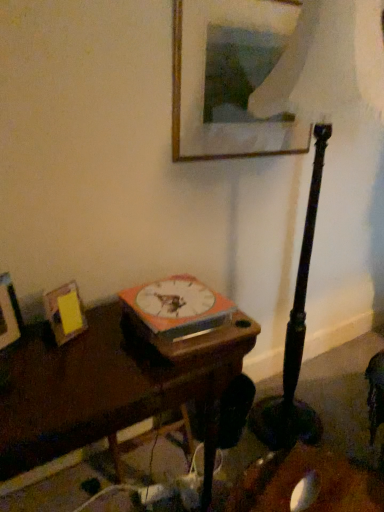
Question: Is wooden picture frame at upper center, acting as the 1th picture frame starting from the right, positioned beyond the bounds of orange matte book at center?

Choices:
 (A) yes
 (B) no

Answer: (A)

Question: Is wooden picture frame at upper center, acting as the 1th picture frame starting from the right, looking in the opposite direction of orange matte book at center?

Choices:
 (A) yes
 (B) no

Answer: (B)

Question: Can you confirm if wooden picture frame at upper center, which is counted as the 3th picture frame, starting from the bottom, is positioned to the left of orange matte book at center?

Choices:
 (A) no
 (B) yes

Answer: (A)

Question: Is wooden picture frame at upper center, marked as the 1th picture frame in a top-to-bottom arrangement, far from orange matte book at center?

Choices:
 (A) no
 (B) yes

Answer: (A)

Question: Is wooden picture frame at upper center, acting as the 1th picture frame starting from the right, closer to the viewer compared to orange matte book at center?

Choices:
 (A) yes
 (B) no

Answer: (B)

Question: Considering their positions, is dark wood table at center located in front of or behind orange matte book at center?

Choices:
 (A) front
 (B) behind

Answer: (A)

Question: Is dark wood table at center to the left or to the right of orange matte book at center in the image?

Choices:
 (A) right
 (B) left

Answer: (B)

Question: Considering the positions of dark wood table at center and orange matte book at center in the image, is dark wood table at center bigger or smaller than orange matte book at center?

Choices:
 (A) small
 (B) big

Answer: (B)

Question: From a real-world perspective, is dark wood table at center positioned above or below orange matte book at center?

Choices:
 (A) below
 (B) above

Answer: (A)

Question: Looking at their shapes, would you say wooden picture frame at upper center, which is counted as the 3th picture frame, starting from the bottom, is wider or thinner than wooden photo frame at left, the third picture frame in the top-to-bottom sequence?

Choices:
 (A) wide
 (B) thin

Answer: (B)

Question: Is wooden picture frame at upper center, which is counted as the 3th picture frame, starting from the bottom, in front of or behind wooden photo frame at left, the third picture frame in the top-to-bottom sequence, in the image?

Choices:
 (A) behind
 (B) front

Answer: (A)

Question: Considering the positions of point (206, 74) and point (6, 334), is point (206, 74) closer or farther from the camera than point (6, 334)?

Choices:
 (A) farther
 (B) closer

Answer: (A)

Question: Is wooden picture frame at upper center, which is counted as the 3th picture frame, starting from the bottom, bigger or smaller than wooden photo frame at left, the third picture frame from the right?

Choices:
 (A) small
 (B) big

Answer: (B)

Question: Would you say yellow paper at left, the second picture frame when ordered from top to bottom, is inside or outside orange matte book at center?

Choices:
 (A) inside
 (B) outside

Answer: (B)

Question: Considering the positions of yellow paper at left, arranged as the 2th picture frame when ordered from the bottom, and orange matte book at center in the image, is yellow paper at left, arranged as the 2th picture frame when ordered from the bottom, taller or shorter than orange matte book at center?

Choices:
 (A) tall
 (B) short

Answer: (A)